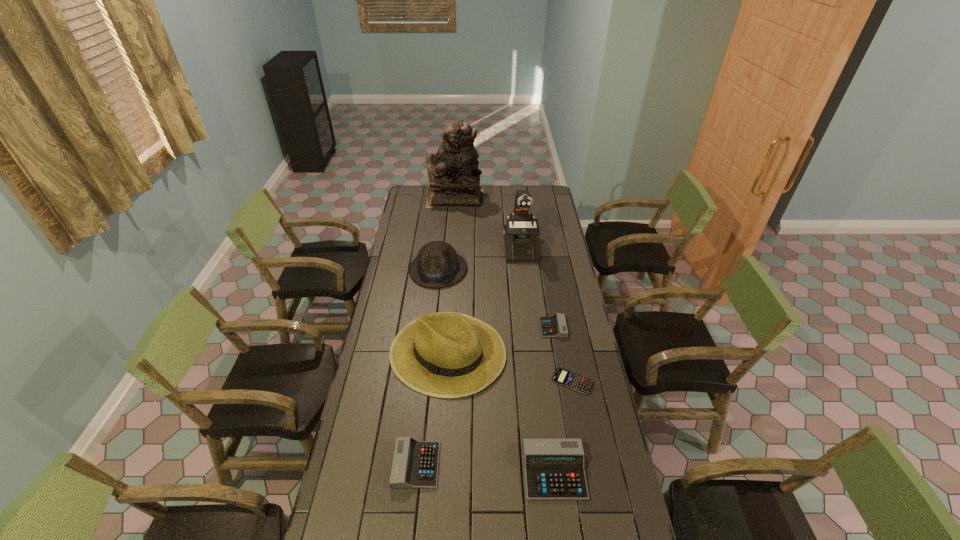
At what (x,y) coordinates should I click in order to perform the action: click on the smallest gray calculator. Please return your answer as a coordinate pair (x, y). The width and height of the screenshot is (960, 540). Looking at the image, I should click on (555, 326).

Image resolution: width=960 pixels, height=540 pixels. Identify the location of the third nearest calculator. [561, 376].

The height and width of the screenshot is (540, 960). In order to click on the shortest object in this screenshot , I will do `click(561, 376)`.

The width and height of the screenshot is (960, 540). I want to click on free space located on the front-facing side of the tallest object, so click(x=500, y=199).

This screenshot has width=960, height=540. Identify the location of free spot located 0.310m through the eyepieces of the second tallest object. (527, 305).

At what (x,y) coordinates should I click in order to perform the action: click on vacant space located on the front of the sunhat. Please return your answer as a coordinate pair (x, y). This screenshot has height=540, width=960. Looking at the image, I should click on (437, 508).

This screenshot has height=540, width=960. In order to click on vacant area located 0.360m on the front-facing side of the fourth tallest object in this screenshot , I will do `click(429, 347)`.

In order to click on vacant space located 0.120m on the left of the fifth tallest object in this screenshot , I will do `click(489, 471)`.

Where is `blank area located 0.130m on the front of the second tallest calculator`? The image size is (960, 540). blank area located 0.130m on the front of the second tallest calculator is located at coordinates [409, 533].

At what (x,y) coordinates should I click in order to perform the action: click on vacant space located on the front of the smallest gray calculator. Please return your answer as a coordinate pair (x, y). This screenshot has height=540, width=960. Looking at the image, I should click on (558, 354).